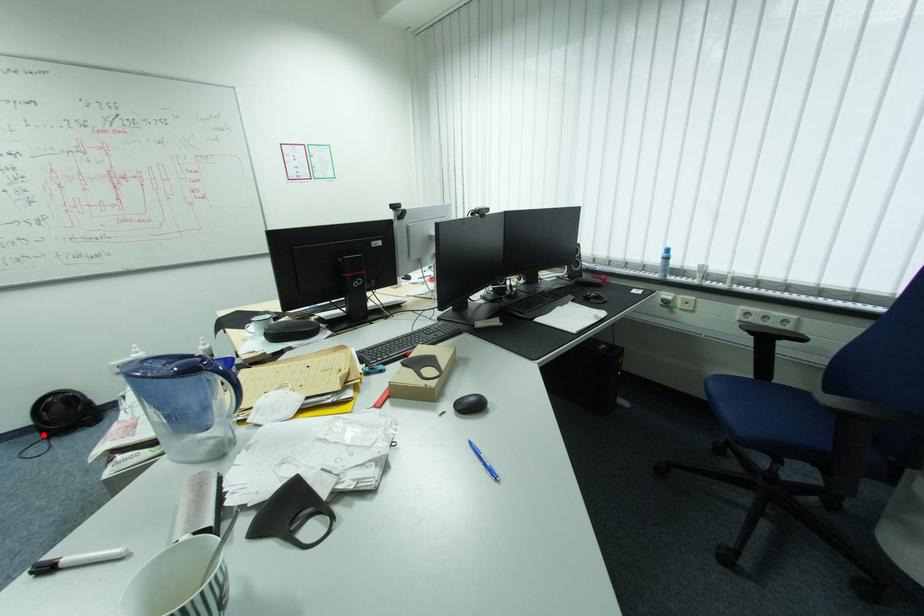
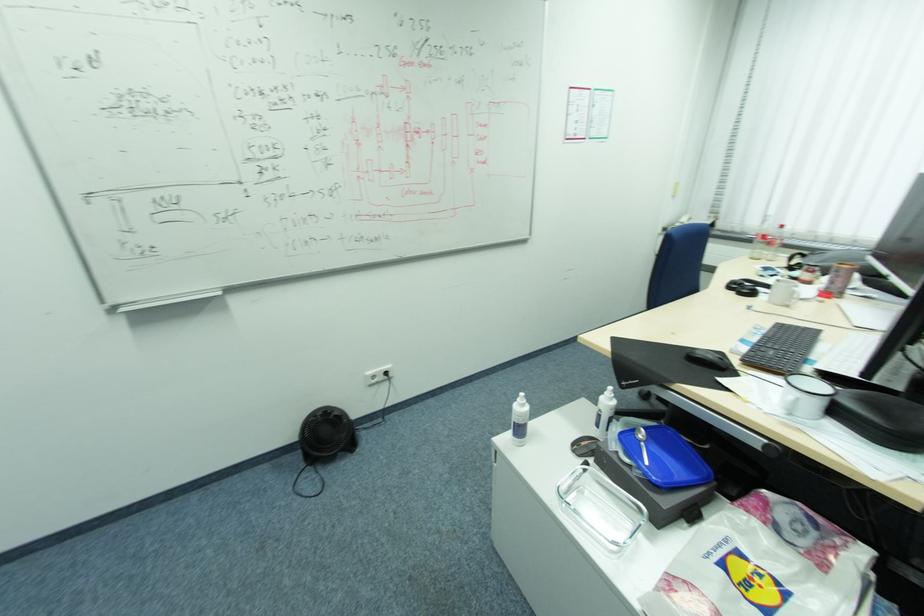
Question: I am providing you with two images of the same scene from different viewpoints. Image1 has a red point marked. In image2, the corresponding 3D location appears at what relative position? Reply with the corresponding letter.

Choices:
 (A) Closer
 (B) Farther

Answer: (B)